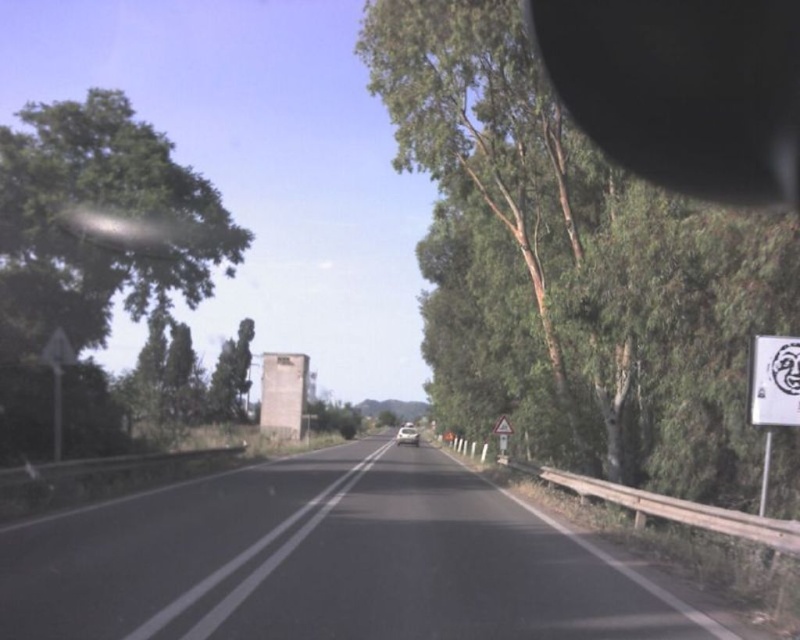
Question: Which point is farther to the camera?

Choices:
 (A) green leafy tree at left
 (B) white plastic speed limit sign at right
 (C) black asphalt road at center

Answer: (B)

Question: Which is nearer to the black rubber view mirror at upper right?

Choices:
 (A) green leafy tree at left
 (B) white plastic speed limit sign at right
 (C) white paper sign at right
 (D) white plastic triangle at left

Answer: (C)

Question: Is green leafy tree at left positioned at the back of white paper sign at right?

Choices:
 (A) yes
 (B) no

Answer: (A)

Question: Which point appears closest to the camera in this image?

Choices:
 (A) [168, 250]
 (B) [550, 228]
 (C) [770, 337]

Answer: (C)

Question: Is white paper sign at right positioned before white plastic speed limit sign at right?

Choices:
 (A) yes
 (B) no

Answer: (A)

Question: Where is green leafy tree at left located in relation to white paper sign at right in the image?

Choices:
 (A) above
 (B) below

Answer: (A)